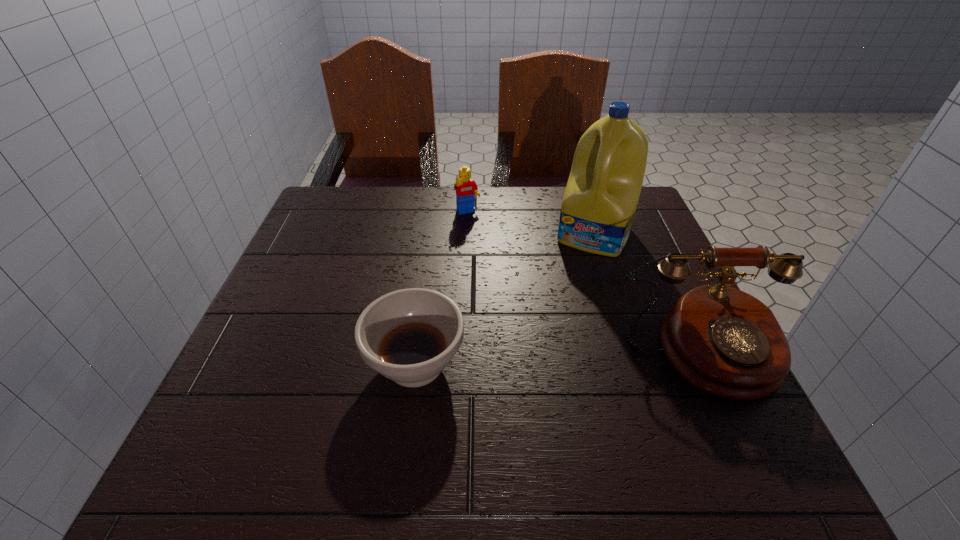
Where is `blank area at the near edge`? The image size is (960, 540). blank area at the near edge is located at coordinates (484, 416).

The width and height of the screenshot is (960, 540). In the image, there is a desktop. In order to click on free space at the left edge in this screenshot , I will do `click(311, 352)`.

Identify the location of vacant space at the right edge of the desktop. (625, 271).

Identify the location of vacant space at the far left corner of the desktop. (342, 218).

In the image, there is a desktop. At what (x,y) coordinates should I click in order to perform the action: click on vacant space at the near left corner. Please return your answer as a coordinate pair (x, y). Image resolution: width=960 pixels, height=540 pixels. Looking at the image, I should click on (299, 422).

The height and width of the screenshot is (540, 960). I want to click on free space between the tallest object and the second tallest object, so click(x=648, y=293).

This screenshot has height=540, width=960. Identify the location of vacant area between the third shortest object and the Lego. (586, 282).

This screenshot has width=960, height=540. Identify the location of free area in between the second shortest object and the tallest object. tap(531, 224).

At what (x,y) coordinates should I click in order to perform the action: click on vacant area between the Lego and the shortest object. Please return your answer as a coordinate pair (x, y). The width and height of the screenshot is (960, 540). Looking at the image, I should click on (442, 288).

I want to click on free area in between the Lego and the third shortest object, so click(x=586, y=282).